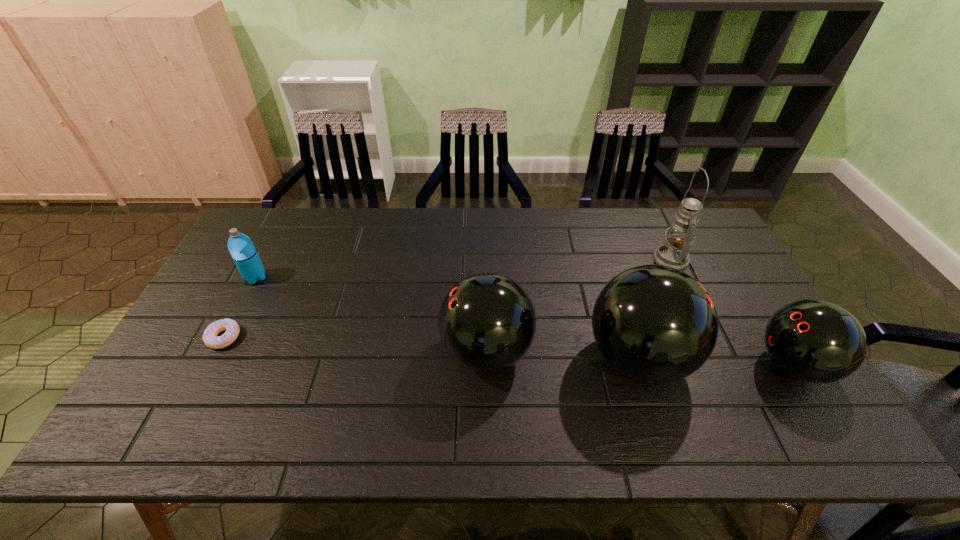
Where is `the third object from left to right`? The image size is (960, 540). the third object from left to right is located at coordinates (487, 322).

In order to click on the second tallest bowling ball in this screenshot , I will do `click(487, 322)`.

Where is `the second bowling ball from left to right`? The width and height of the screenshot is (960, 540). the second bowling ball from left to right is located at coordinates (656, 324).

This screenshot has height=540, width=960. I want to click on the rightmost object, so click(x=815, y=341).

This screenshot has height=540, width=960. What are the coordinates of `the rightmost bowling ball` in the screenshot? It's located at (815, 341).

Locate an element on the screen. The width and height of the screenshot is (960, 540). the second object from right to left is located at coordinates (674, 253).

Identify the location of thermos bottle. The image size is (960, 540). (241, 248).

Where is `the shortest object`? This screenshot has height=540, width=960. the shortest object is located at coordinates (210, 338).

What are the coordinates of `free space located on the surface of the third tallest object near the finger holes` in the screenshot? It's located at (347, 352).

Image resolution: width=960 pixels, height=540 pixels. In order to click on free space located on the surface of the third tallest object near the finger holes in this screenshot , I will do `click(297, 352)`.